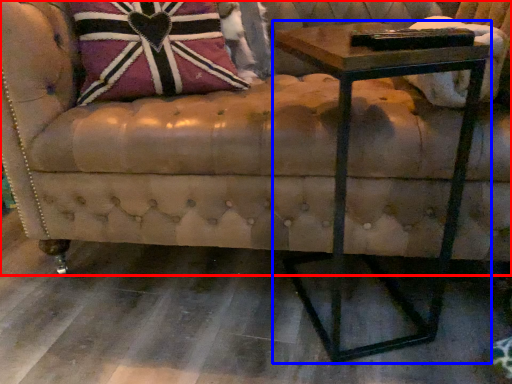
Question: Among these objects, which one is farthest to the camera, studio couch (highlighted by a red box) or table (highlighted by a blue box)?

Choices:
 (A) studio couch
 (B) table

Answer: (A)